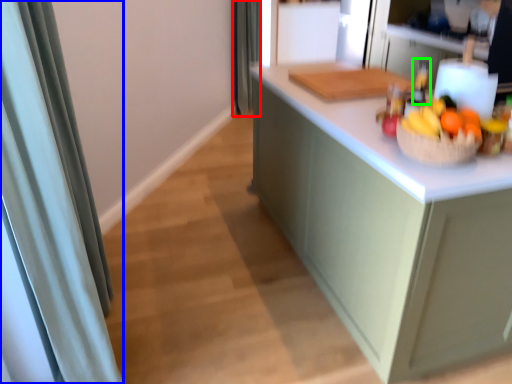
Question: Which is nearer to the shower curtain (highlighted by a red box)? shower curtain (highlighted by a blue box) or bottle (highlighted by a green box).

Choices:
 (A) shower curtain
 (B) bottle

Answer: (B)